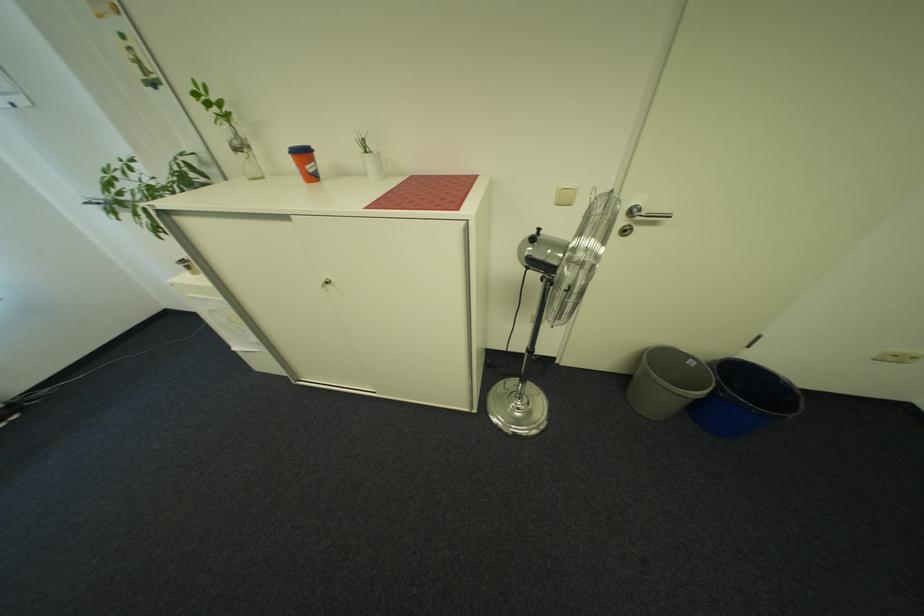
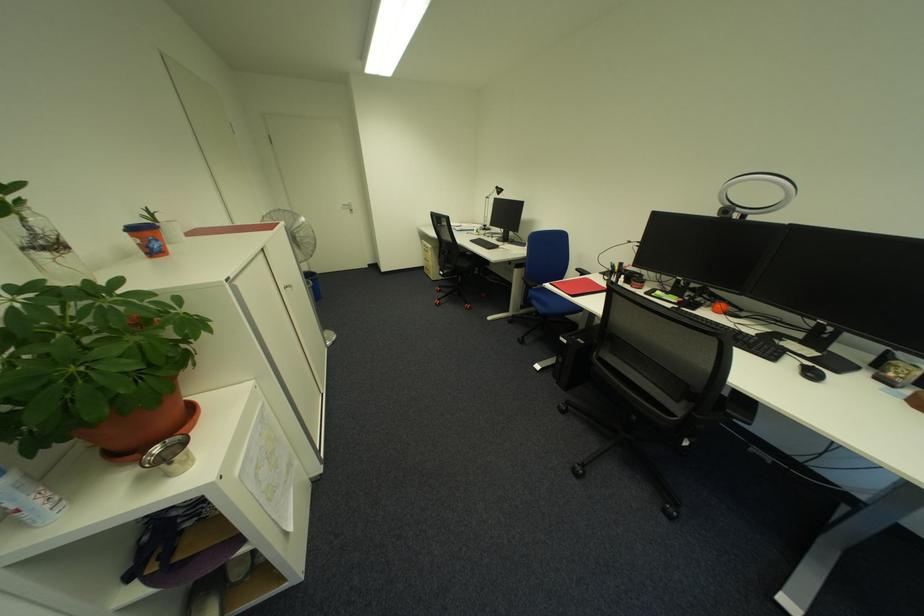
Locate, in the second image, the point that corresponds to pixel 247 135 in the first image.

(40, 230)